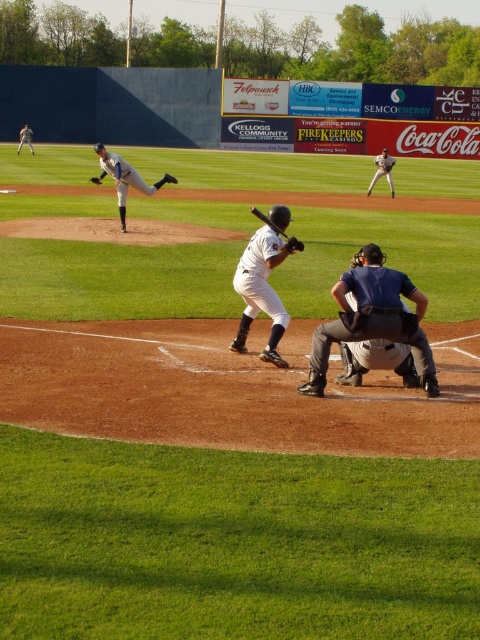
Question: Which object is farther from the camera taking this photo?

Choices:
 (A) black leather glove at center
 (B) wooden baseball bat at center
 (C) gray fabric umpire at center
 (D) brown leather glove at lower center

Answer: (A)

Question: Estimate the real-world distances between objects in this image. Which object is farther from the white matte baseball bat at center?

Choices:
 (A) black leather glove at center
 (B) white uniform glove at right
 (C) gray fabric umpire at center
 (D) brown leather glove at upper center

Answer: (B)

Question: Can you confirm if white uniform glove at right is thinner than brown leather glove at lower center?

Choices:
 (A) yes
 (B) no

Answer: (B)

Question: Does gray fabric umpire at center lie in front of white matte baseball bat at center?

Choices:
 (A) yes
 (B) no

Answer: (A)

Question: Which of these objects is positioned farthest from the gray fabric umpire at center?

Choices:
 (A) wooden baseball bat at center
 (B) white uniformed player at center
 (C) white uniformed pitcher at upper left
 (D) white matte baseball bat at center

Answer: (B)

Question: Does gray fabric umpire at center appear over brown leather glove at upper center?

Choices:
 (A) no
 (B) yes

Answer: (A)